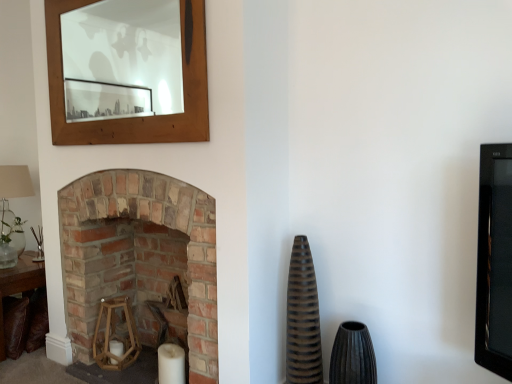
Question: From the image's perspective, is brick fireplace at left beneath matte brown vase at center-right, which ranks as the first vase in right-to-left order?

Choices:
 (A) yes
 (B) no

Answer: (B)

Question: Is brick fireplace at left facing away from matte brown vase at center-right, which ranks as the first vase in right-to-left order?

Choices:
 (A) no
 (B) yes

Answer: (A)

Question: Does brick fireplace at left have a lesser height compared to matte brown vase at center-right, which is counted as the second vase, starting from the left?

Choices:
 (A) yes
 (B) no

Answer: (B)

Question: From a real-world perspective, is brick fireplace at left positioned under matte brown vase at center-right, which is counted as the second vase, starting from the left, based on gravity?

Choices:
 (A) yes
 (B) no

Answer: (B)

Question: Is matte brown vase at center-right, which ranks as the first vase in right-to-left order, surrounded by brick fireplace at left?

Choices:
 (A) no
 (B) yes

Answer: (A)

Question: Considering their positions, is wooden hexagonal candle holder at lower left located in front of or behind wooden frame at upper left?

Choices:
 (A) behind
 (B) front

Answer: (A)

Question: Considering the positions of wooden hexagonal candle holder at lower left and wooden frame at upper left in the image, is wooden hexagonal candle holder at lower left wider or thinner than wooden frame at upper left?

Choices:
 (A) thin
 (B) wide

Answer: (B)

Question: Looking at the image, does wooden hexagonal candle holder at lower left seem bigger or smaller compared to wooden frame at upper left?

Choices:
 (A) small
 (B) big

Answer: (A)

Question: Considering the positions of point (99, 316) and point (122, 76), is point (99, 316) closer or farther from the camera than point (122, 76)?

Choices:
 (A) closer
 (B) farther

Answer: (A)

Question: From a real-world perspective, is brown ribbed vase at center-right, the 1th vase viewed from the left, above or below matte brown vase at center-right, which is counted as the second vase, starting from the left?

Choices:
 (A) below
 (B) above

Answer: (B)

Question: From the image's perspective, is brown ribbed vase at center-right, the 1th vase viewed from the left, located above or below matte brown vase at center-right, which ranks as the first vase in right-to-left order?

Choices:
 (A) above
 (B) below

Answer: (A)

Question: In terms of width, does brown ribbed vase at center-right, which is counted as the second vase, starting from the right, look wider or thinner when compared to matte brown vase at center-right, which is counted as the second vase, starting from the left?

Choices:
 (A) wide
 (B) thin

Answer: (B)

Question: Considering their positions, is brown ribbed vase at center-right, which is counted as the second vase, starting from the right, located in front of or behind matte brown vase at center-right, which is counted as the second vase, starting from the left?

Choices:
 (A) front
 (B) behind

Answer: (B)

Question: In terms of size, does brown ribbed vase at center-right, which is counted as the second vase, starting from the right, appear bigger or smaller than brown leather table at lower left?

Choices:
 (A) small
 (B) big

Answer: (A)

Question: From a real-world perspective, is brown ribbed vase at center-right, the 1th vase viewed from the left, positioned above or below brown leather table at lower left?

Choices:
 (A) above
 (B) below

Answer: (A)